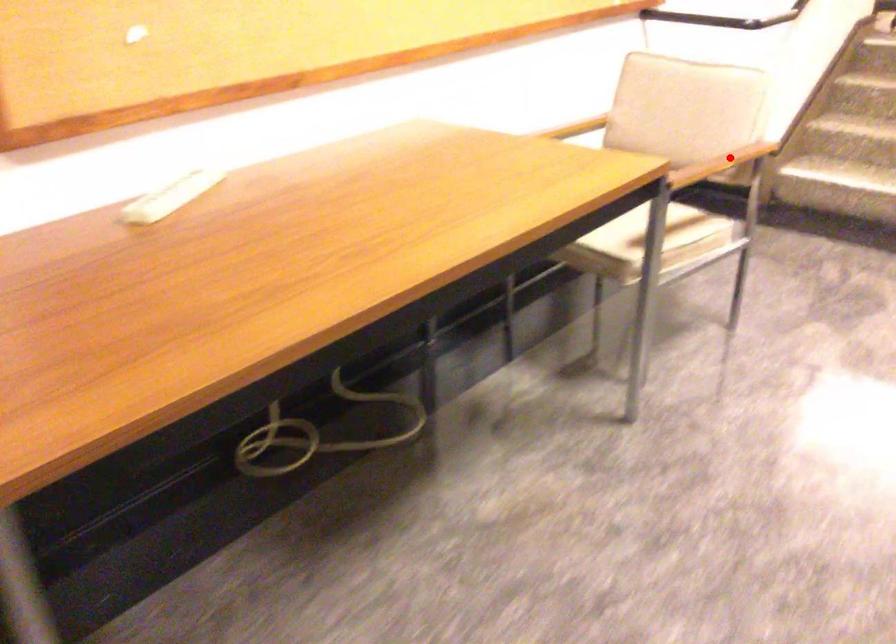
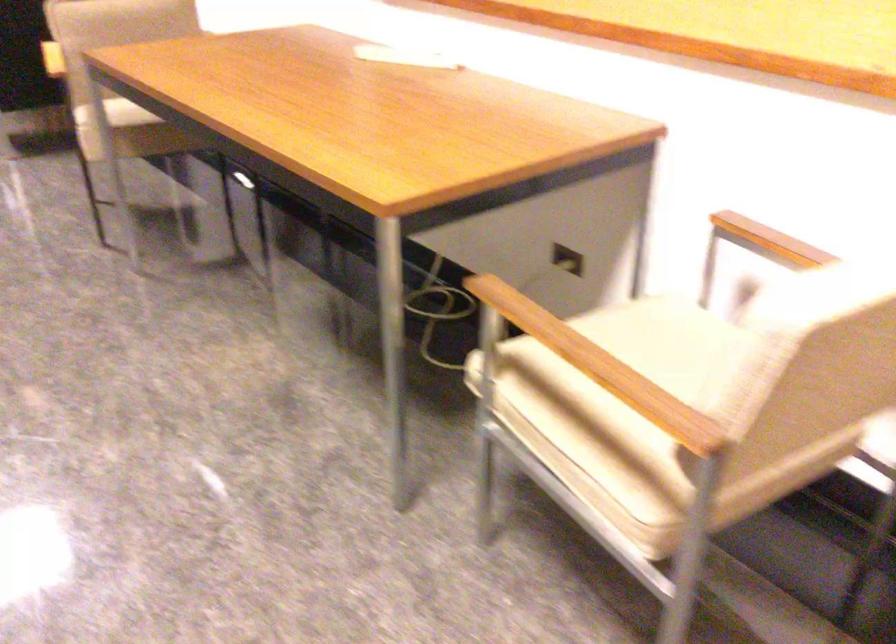
Question: I am providing you with two images of the same scene from different viewpoints. A red point is marked on the first image. Can you still see the location of the red point in image 2?

Choices:
 (A) Yes
 (B) No

Answer: (A)